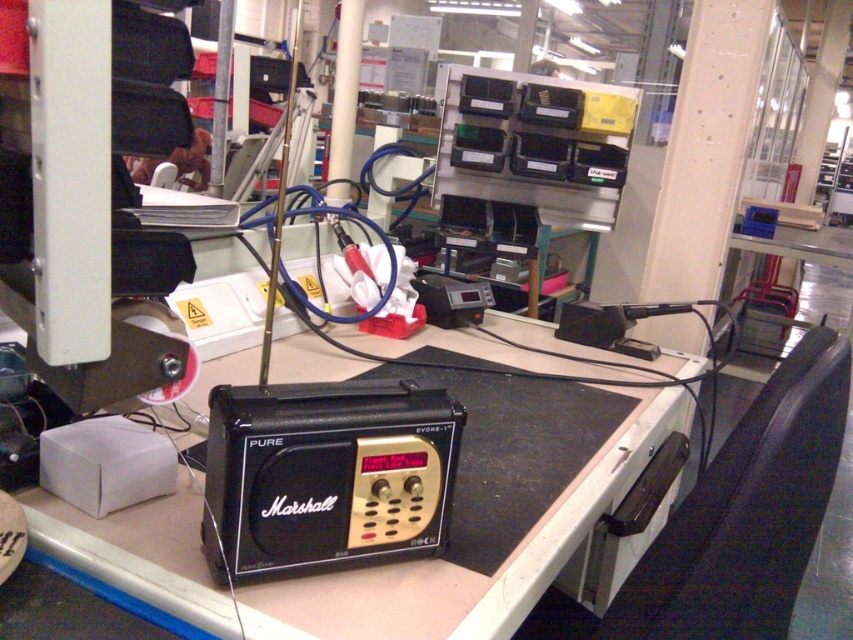
You are a technician holding a 30 inch long tool. You need to place it on the black plastic table at center without it hanging off the edge. Is the table long enough?

The black plastic table at center is 28.73 inches from camera. Since the tool is 30 inches long, it is longer than the table, so placing it without overhang is not possible.

Based on the photo, you are an electronics technician working in the facility. You need to place a new component on the surface between the black plastic table at center and the black matte radio at center. Which object should you place it on if you want it closer to the radio?

You should place the new component on the black matte radio at center because it is smaller and positioned closer to the radio than the black plastic table at center.

You are an engineer working in this electronics facility and need to determine the relative positions of two points on the workbench. Which of the two points, point (666,392) or point (241,557), is closer to you?

Point (666,392) is closer to you because it is further to the viewer than point (241,557).